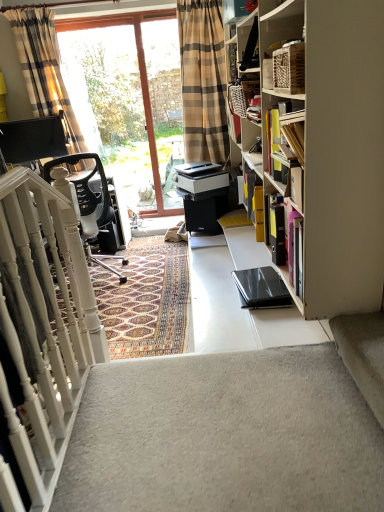
Question: Is plaid fabric curtain at upper left wider or thinner than transparent glass window at upper center?

Choices:
 (A) thin
 (B) wide

Answer: (B)

Question: Relative to transparent glass window at upper center, is plaid fabric curtain at upper left in front or behind?

Choices:
 (A) behind
 (B) front

Answer: (B)

Question: Estimate the real-world distances between objects in this image. Which object is farther from the plaid fabric curtain at upper left?

Choices:
 (A) yellow cardboard boxes at upper right
 (B) white painted wood stairs at left
 (C) black mesh office chair at left
 (D) transparent glass window at upper center
 (E) white carpet at lower left

Answer: (E)

Question: Which object is positioned farthest from the black mesh office chair at left?

Choices:
 (A) yellow cardboard boxes at upper right
 (B) plaid fabric curtain at upper left
 (C) white carpet at lower left
 (D) patterned carpet at center
 (E) white painted wood stairs at left

Answer: (C)